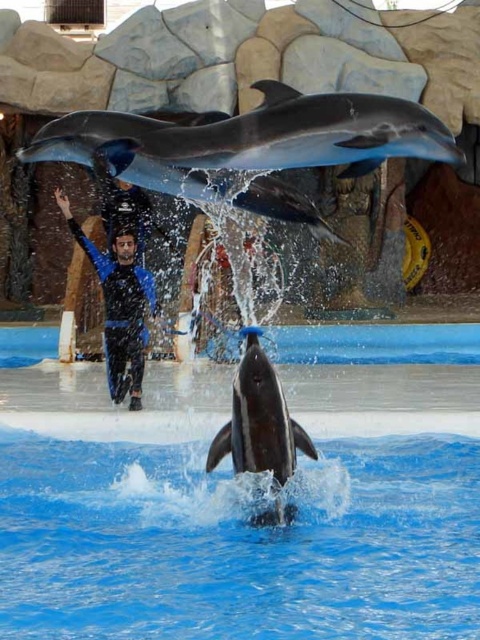
Question: Which point is farther to the camera?

Choices:
 (A) blue rubber suit at center
 (B) blue glossy water at center

Answer: (A)

Question: Does blue glossy water at center appear on the right side of smooth gray dolphin at center?

Choices:
 (A) no
 (B) yes

Answer: (A)

Question: Is blue glossy water at center smaller than blue rubber suit at center?

Choices:
 (A) yes
 (B) no

Answer: (B)

Question: Which object appears farthest from the camera in this image?

Choices:
 (A) blue glossy water at center
 (B) blue rubber suit at center
 (C) smooth gray dolphin at center

Answer: (B)

Question: Based on their relative distances, which object is nearer to the blue rubber suit at center?

Choices:
 (A) smooth gray dolphin at center
 (B) blue glossy water at center

Answer: (B)

Question: Is smooth gray dolphin at center further to camera compared to blue rubber suit at center?

Choices:
 (A) yes
 (B) no

Answer: (B)